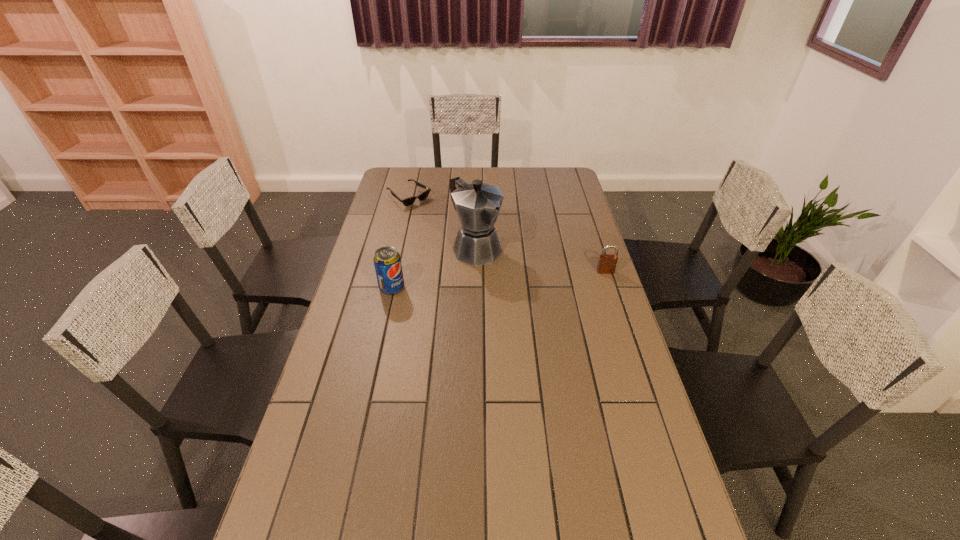
You are a GUI agent. You are given a task and a screenshot of the screen. Output one action in this format:
    pyautogui.click(x=<x>, y=<y>)
    Task: Click on the nearest object
    The image size is (960, 540).
    Given the screenshot: What is the action you would take?
    pyautogui.click(x=387, y=261)

You are a GUI agent. You are given a task and a screenshot of the screen. Output one action in this format:
    pyautogui.click(x=<x>, y=<y>)
    Task: Click on the soda
    The height and width of the screenshot is (540, 960).
    Given the screenshot: What is the action you would take?
    pyautogui.click(x=387, y=261)

Image resolution: width=960 pixels, height=540 pixels. I want to click on the third farthest object, so click(607, 263).

The width and height of the screenshot is (960, 540). I want to click on the second shortest object, so click(607, 263).

This screenshot has width=960, height=540. I want to click on sunglasses, so click(408, 201).

The height and width of the screenshot is (540, 960). Find the location of `the farthest object`. the farthest object is located at coordinates (408, 201).

Find the location of a particular element. the third nearest object is located at coordinates (477, 204).

The width and height of the screenshot is (960, 540). I want to click on the third object from left to right, so click(477, 204).

This screenshot has height=540, width=960. I want to click on free space located on the left of the second tallest object, so click(353, 288).

The width and height of the screenshot is (960, 540). Identify the location of vacant space located 0.180m on the front-facing side of the rightmost object. (618, 309).